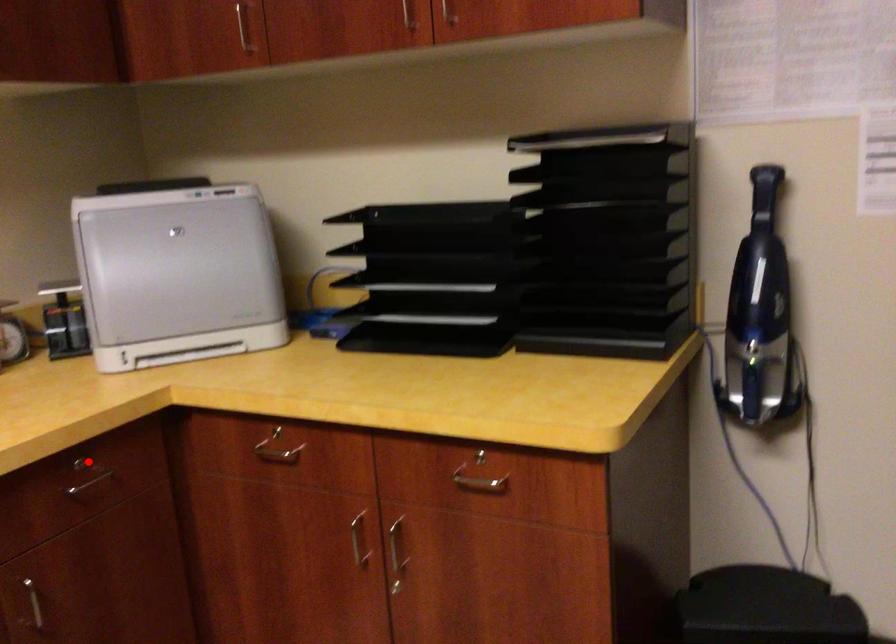
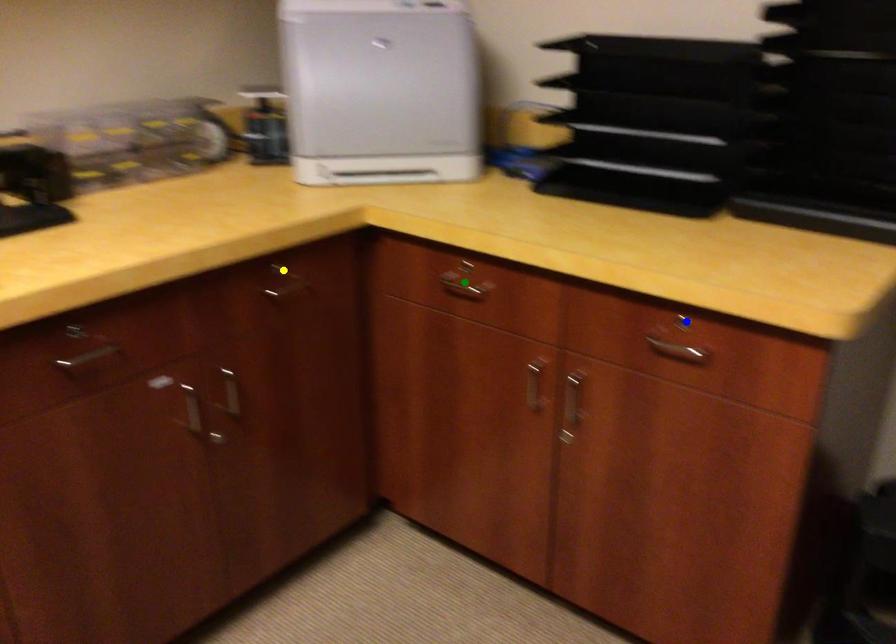
Question: I am providing you with two images of the same scene from different viewpoints. A red point is marked on the first image. You are given multiple points on the second image. Which mark in image 2 goes with the point in image 1?

Choices:
 (A) green point
 (B) blue point
 (C) yellow point

Answer: (C)